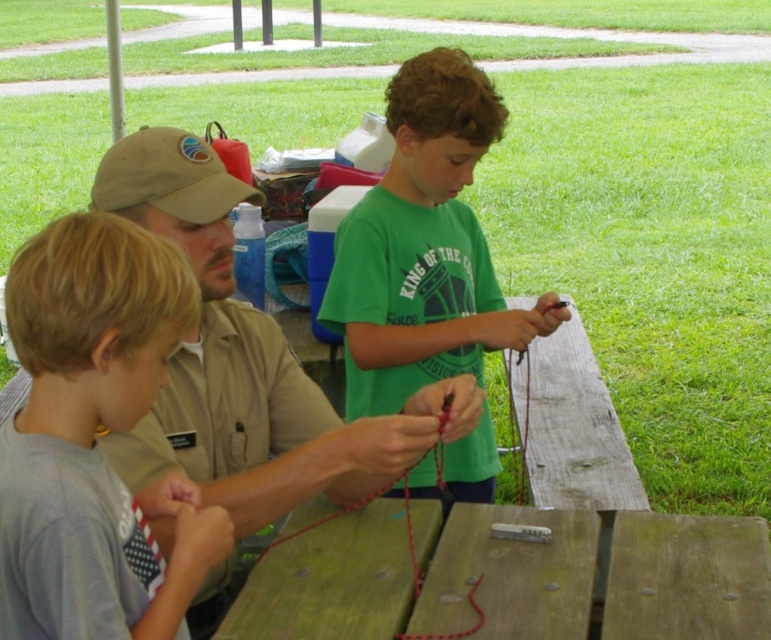
You are a person who wants to place a 18 inch long object between the wooden at center and the green matte shirt at center. Is there enough space?

The distance between wooden at center and green matte shirt at center is 21.10 inches. Since the object is 18 inches long, there is enough space to place it between them.

From the picture: What is the location of the point at coordinates (234, 360) in the image?

The point at coordinates (234, 360) is located on the khaki fabric shirt at center.